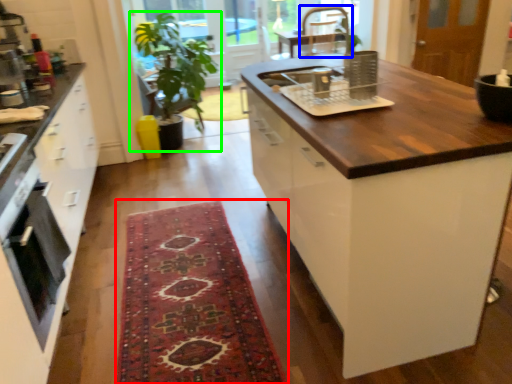
Question: Based on their relative distances, which object is farther from mat (highlighted by a red box)? Choose from chair (highlighted by a blue box) and houseplant (highlighted by a green box).

Choices:
 (A) chair
 (B) houseplant

Answer: (A)